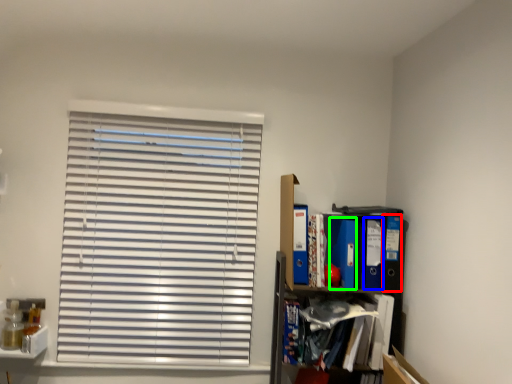
Question: Considering the real-world distances, which object is farthest from paperback book (highlighted by a red box)? paperback book (highlighted by a blue box) or paperback book (highlighted by a green box)?

Choices:
 (A) paperback book
 (B) paperback book

Answer: (B)